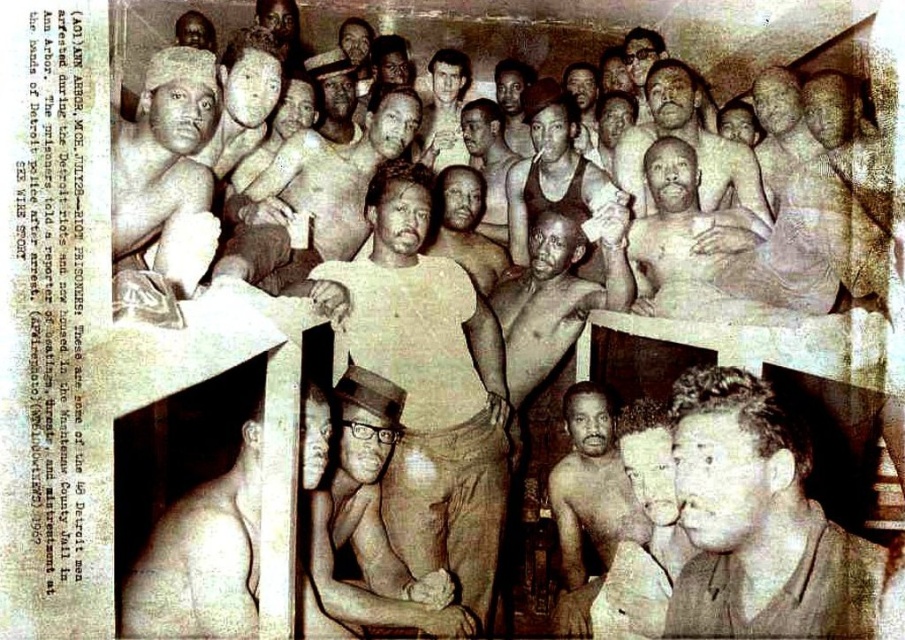
Question: Does smooth black hat at center have a smaller size compared to smooth skin man at center?

Choices:
 (A) yes
 (B) no

Answer: (B)

Question: Which object is positioned farthest from the light beige cotton shirt at center?

Choices:
 (A) smooth black hat at center
 (B) fuzzy fabric hat at upper left
 (C) smooth skin man at center
 (D) light brown shirt at lower right

Answer: (D)

Question: Can you confirm if light beige cotton shirt at center is positioned below smooth skin face at upper center?

Choices:
 (A) no
 (B) yes

Answer: (B)

Question: Among these objects, which one is nearest to the camera?

Choices:
 (A) smooth skin man at center
 (B) dark brown leather jacket at center
 (C) smooth black hat at center

Answer: (C)

Question: Can you confirm if light brown shirt at lower right is positioned below smooth black hat at center?

Choices:
 (A) yes
 (B) no

Answer: (B)

Question: Which object is the closest to the dark brown leather jacket at center?

Choices:
 (A) smooth skin face at upper center
 (B) smooth skin man at center
 (C) light brown shirt at lower right

Answer: (A)